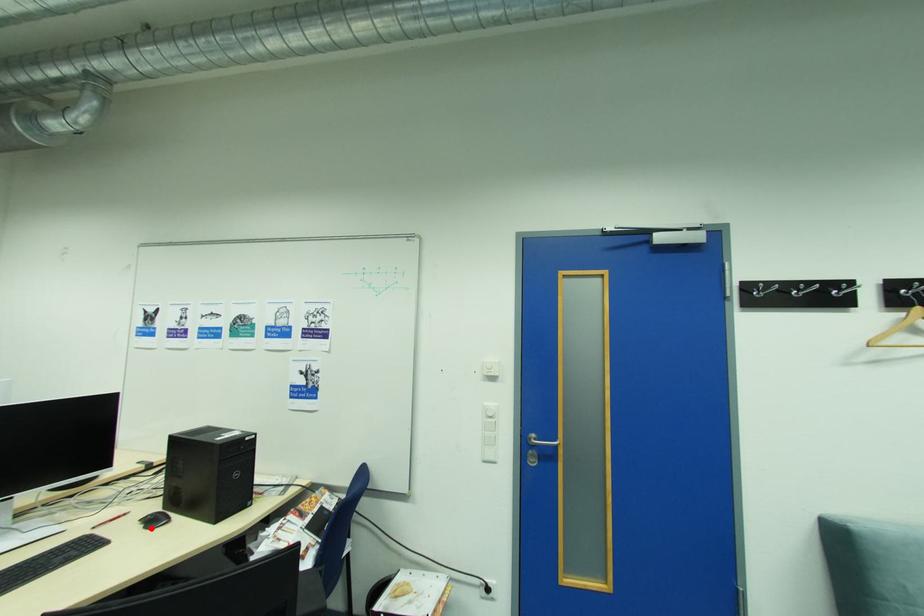
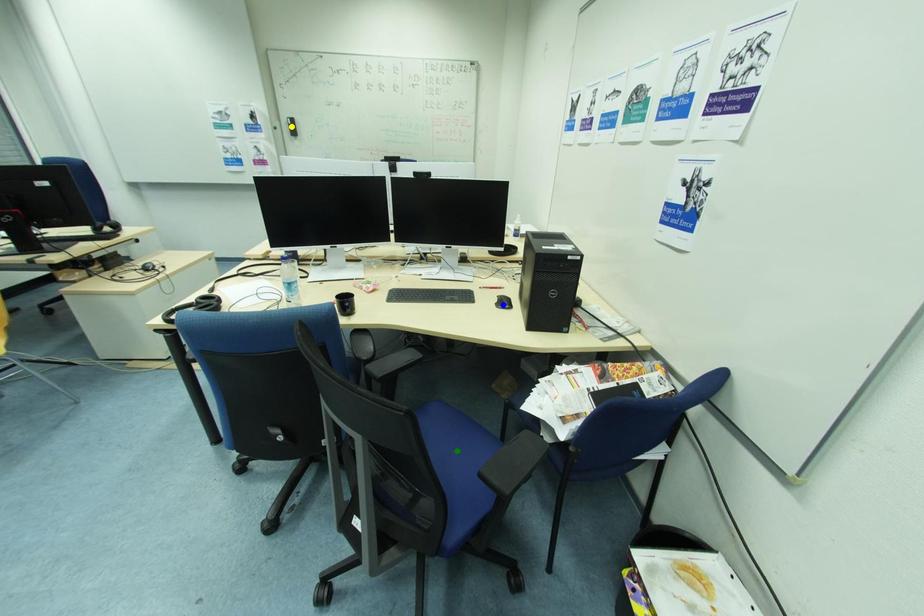
Question: I am providing you with two images of the same scene from different viewpoints. A red point is marked on the first image. You are given multiple points on the second image. Which point in image 2 is actually the same real-world point as the red point in image 1?

Choices:
 (A) yellow point
 (B) blue point
 (C) green point

Answer: (B)